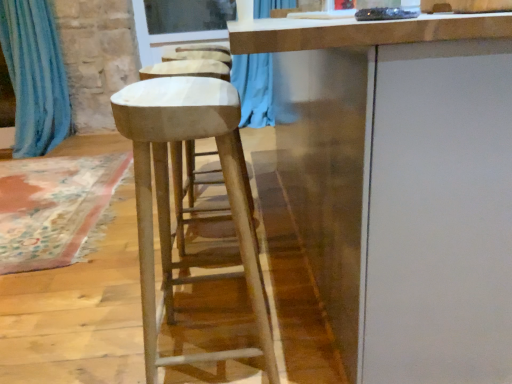
The image size is (512, 384). I want to click on vacant space behind smooth white stool at center, so click(228, 292).